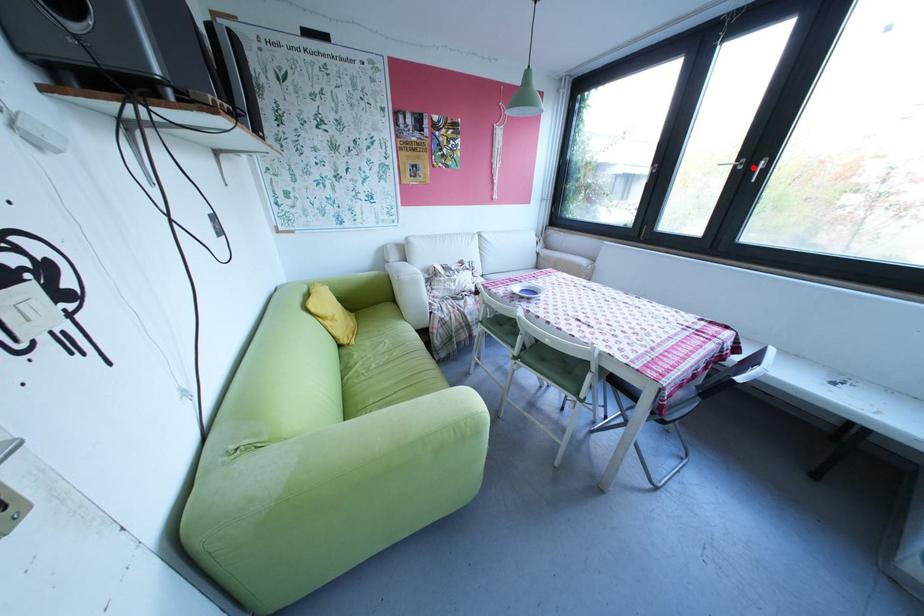
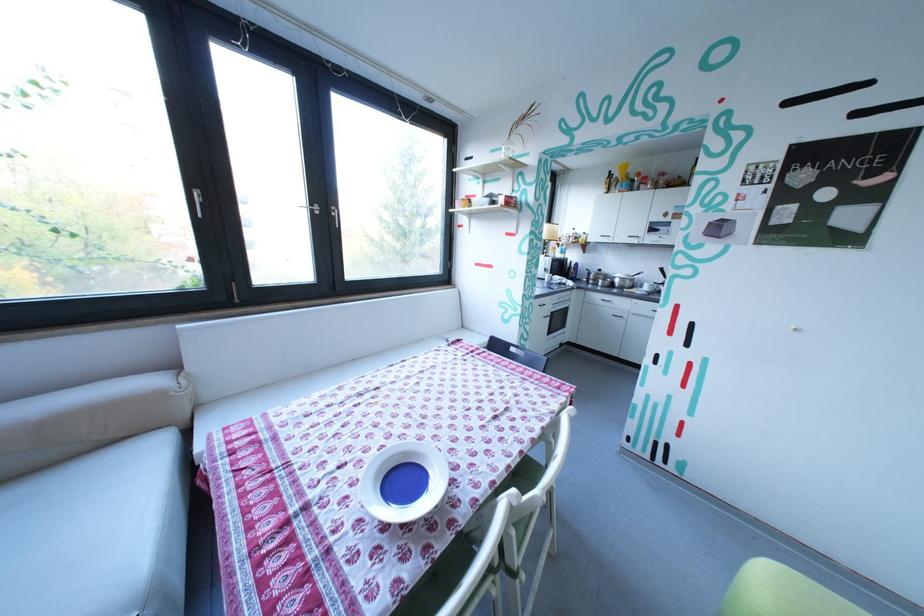
Question: I am providing you with two images of the same scene from different viewpoints. In image1, a red point is highlighted. Considering the same 3D point in image2, which of the following is correct?

Choices:
 (A) It is closer
 (B) It is farther

Answer: (A)